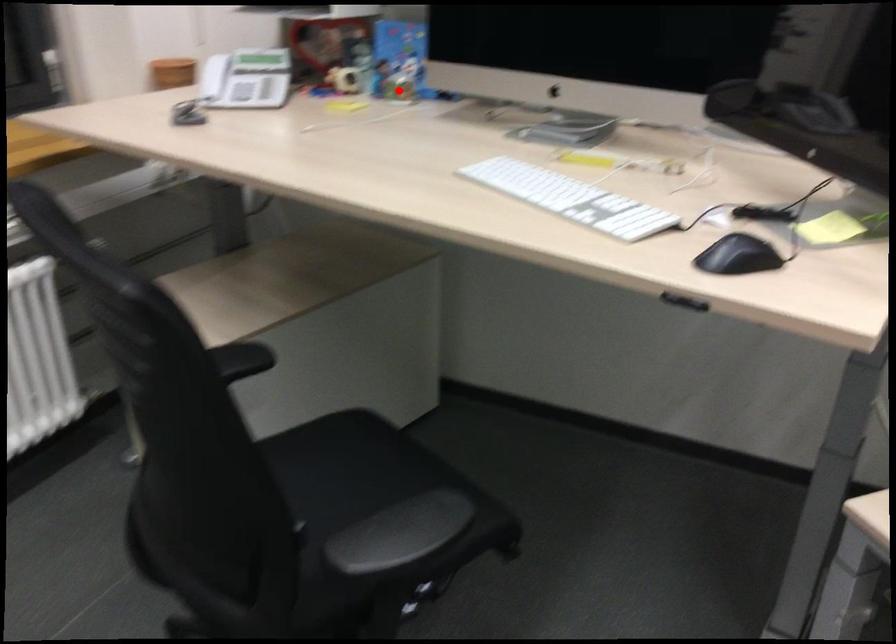
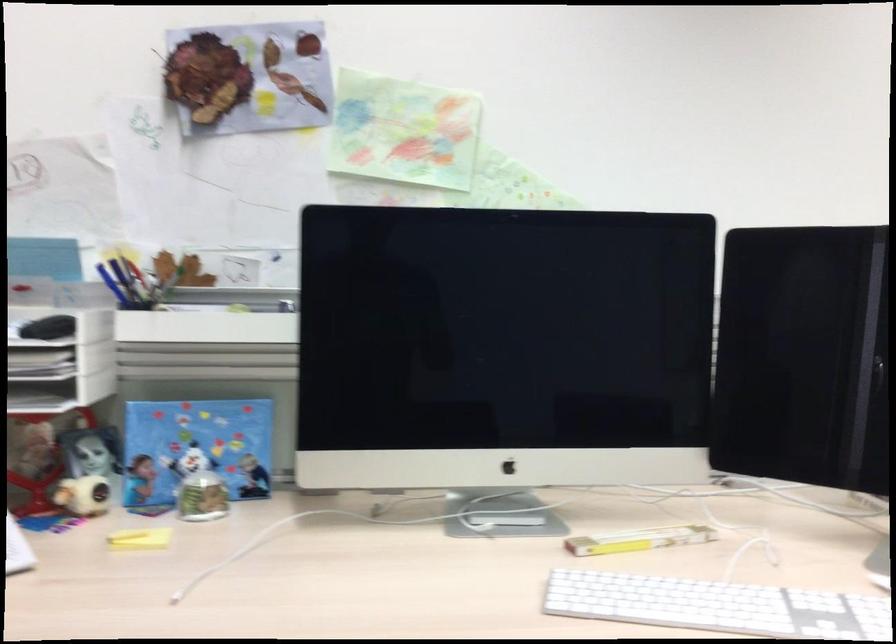
Find the pixel in the second image that matches the highlighted location in the first image.

(202, 497)